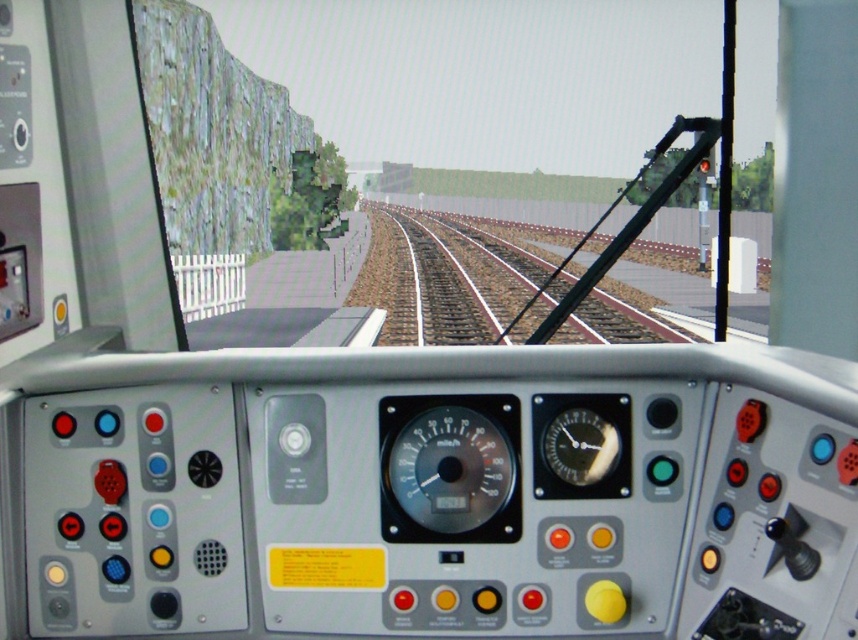
You are a train operator in the simulator. You notice two objects on the control panel in front of you. One is the brown gravel track at center and the other is the shiny black clock at center. Which object is taller?

The brown gravel track at center is taller than the shiny black clock at center.

You are a train operator in the simulator and need to reach the shiny black clock at center to check the time. The control panel is between you and the clock. Can you safely walk around the control panel to reach the clock without stepping on the brown gravel track at center?

The brown gravel track at center and shiny black clock at center are 10.65 meters apart. Since the control panel is between you and the clock, you can safely walk around it to reach the clock without stepping on the track as there is sufficient space between them.

You are a train operator in the simulator. You need to locate the matte black speedometer at center to monitor your speed. Where is it positioned on the control panel?

The matte black speedometer at center is positioned at point (449,468) on the control panel.